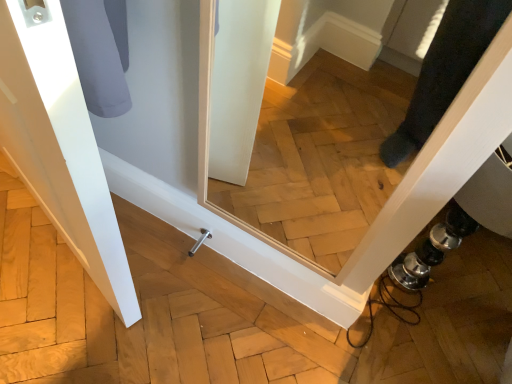
Image resolution: width=512 pixels, height=384 pixels. I want to click on satin nickel door handle at lower center, so click(x=200, y=241).

Image resolution: width=512 pixels, height=384 pixels. Describe the element at coordinates (200, 241) in the screenshot. I see `satin nickel door handle at lower center` at that location.

What are the coordinates of `white matte door at left` in the screenshot? It's located at (60, 147).

Describe the element at coordinates (60, 147) in the screenshot. I see `white matte door at left` at that location.

You are a GUI agent. You are given a task and a screenshot of the screen. Output one action in this format:
    pyautogui.click(x=<x>, y=<y>)
    Task: Click on the satin nickel door handle at lower center
    Image resolution: width=512 pixels, height=384 pixels.
    Given the screenshot: What is the action you would take?
    pyautogui.click(x=200, y=241)

Between white matte door at left and satin nickel door handle at lower center, which one appears on the right side from the viewer's perspective?

From the viewer's perspective, satin nickel door handle at lower center appears more on the right side.

Which object is closer to the camera, white matte door at left or satin nickel door handle at lower center?

Positioned in front is white matte door at left.

Which is nearer, (44, 78) or (204, 232)?

The point (44, 78) is closer.

From the image's perspective, is white matte door at left under satin nickel door handle at lower center?

No, from the image's perspective, white matte door at left is not beneath satin nickel door handle at lower center.

From a real-world perspective, is white matte door at left positioned above or below satin nickel door handle at lower center?

Clearly, from a real-world perspective, white matte door at left is above satin nickel door handle at lower center.

Considering the sizes of objects white matte door at left and satin nickel door handle at lower center in the image provided, who is thinner, white matte door at left or satin nickel door handle at lower center?

With smaller width is satin nickel door handle at lower center.

Is white matte door at left taller than satin nickel door handle at lower center?

Yes, white matte door at left is taller than satin nickel door handle at lower center.

Considering the sizes of white matte door at left and satin nickel door handle at lower center in the image, is white matte door at left bigger or smaller than satin nickel door handle at lower center?

Considering their sizes, white matte door at left takes up more space than satin nickel door handle at lower center.

Is satin nickel door handle at lower center located within white matte door at left?

No.

Are white matte door at left and satin nickel door handle at lower center making contact?

No.

Is white matte door at left looking in the opposite direction of satin nickel door handle at lower center?

Yes, white matte door at left is positioned with its back facing satin nickel door handle at lower center.

Can you tell me how much white matte door at left and satin nickel door handle at lower center differ in facing direction?

They differ by 22.2 degrees in their facing directions.

This screenshot has width=512, height=384. Identify the location of door handle located underneath the white matte door at left (from a real-world perspective). (200, 241).

Which is more to the left, satin nickel door handle at lower center or white matte door at left?

Positioned to the left is white matte door at left.

Is the position of satin nickel door handle at lower center more distant than that of white matte door at left?

Yes, satin nickel door handle at lower center is further from the viewer.

Is point (200, 238) closer or farther from the camera than point (51, 191)?

Point (200, 238) appears to be farther away from the viewer than point (51, 191).

From the image's perspective, which one is positioned higher, satin nickel door handle at lower center or white matte door at left?

white matte door at left.

From a real-world perspective, is satin nickel door handle at lower center located higher than white matte door at left?

No, from a real-world perspective, satin nickel door handle at lower center is not on top of white matte door at left.

Considering the sizes of objects satin nickel door handle at lower center and white matte door at left in the image provided, who is thinner, satin nickel door handle at lower center or white matte door at left?

satin nickel door handle at lower center is thinner.

From their relative heights in the image, would you say satin nickel door handle at lower center is taller or shorter than white matte door at left?

satin nickel door handle at lower center is shorter than white matte door at left.

Is satin nickel door handle at lower center bigger or smaller than white matte door at left?

In the image, satin nickel door handle at lower center appears to be smaller than white matte door at left.

Is satin nickel door handle at lower center inside or outside of white matte door at left?

satin nickel door handle at lower center cannot be found inside white matte door at left.

Can you see satin nickel door handle at lower center touching white matte door at left?

They are not placed beside each other.

Could you tell me if satin nickel door handle at lower center is turned towards white matte door at left?

Yes, satin nickel door handle at lower center faces towards white matte door at left.

What's the angular difference between satin nickel door handle at lower center and white matte door at left's facing directions?

The angle between the facing direction of satin nickel door handle at lower center and the facing direction of white matte door at left is 22.2 degrees.

The width and height of the screenshot is (512, 384). Identify the location of door that appears on the left of satin nickel door handle at lower center. (60, 147).

Locate an element on the screen. The image size is (512, 384). door handle below the white matte door at left (from the image's perspective) is located at coordinates (200, 241).

There is a satin nickel door handle at lower center. Where is `door above it (from a real-world perspective)`? door above it (from a real-world perspective) is located at coordinates (60, 147).